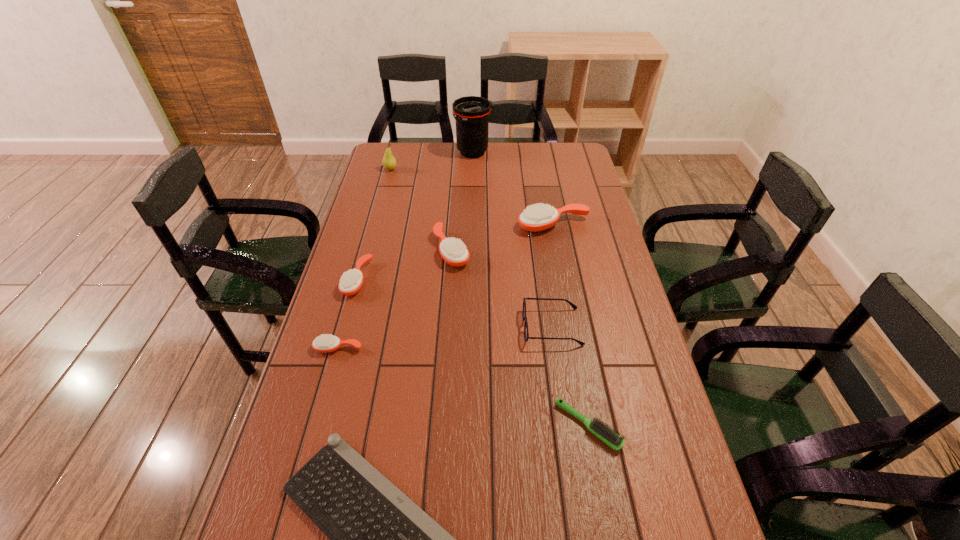
Locate an element on the screen. The height and width of the screenshot is (540, 960). vacant space located on the front-facing side of the spectacles is located at coordinates (402, 327).

In order to click on free space located on the right of the third tallest hairbrush in this screenshot , I will do `click(398, 279)`.

This screenshot has height=540, width=960. In order to click on vacant area located on the front of the nearest orange hairbrush in this screenshot , I will do [331, 374].

The image size is (960, 540). In order to click on free space located on the back of the light hairbrush in this screenshot , I will do `click(564, 298)`.

At what (x,y) coordinates should I click in order to perform the action: click on telephoto lens at the far edge. Please return your answer as a coordinate pair (x, y). Looking at the image, I should click on coord(472,113).

Find the location of `pear that is at the far edge`. pear that is at the far edge is located at coordinates (389, 162).

Locate an element on the screen. pear located in the left edge section of the desktop is located at coordinates (389, 162).

In order to click on object that is at the far left corner in this screenshot , I will do `click(389, 162)`.

You are a GUI agent. You are given a task and a screenshot of the screen. Output one action in this format:
    pyautogui.click(x=<x>, y=<y>)
    Task: Click on the blank area at the left edge
    The image size is (960, 540).
    Given the screenshot: What is the action you would take?
    pyautogui.click(x=346, y=255)

In the image, there is a desktop. At what (x,y) coordinates should I click in order to perform the action: click on vacant space at the right edge. Please return your answer as a coordinate pair (x, y). The image size is (960, 540). Looking at the image, I should click on (579, 274).